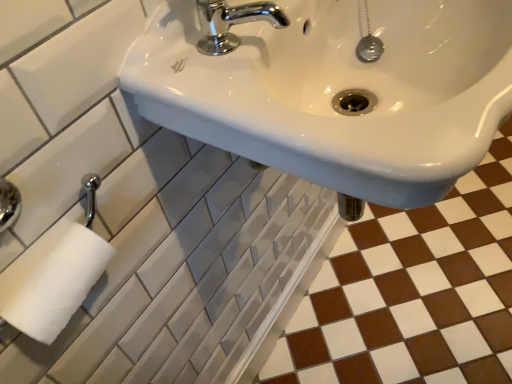
Question: In terms of height, does white glossy sink at upper center look taller or shorter compared to chrome/metallic faucet at upper center?

Choices:
 (A) short
 (B) tall

Answer: (B)

Question: Is white glossy sink at upper center wider or thinner than chrome/metallic faucet at upper center?

Choices:
 (A) wide
 (B) thin

Answer: (A)

Question: Which of these objects is positioned closest to the chrome/metallic faucet at upper center?

Choices:
 (A) brown glossy tile at lower right
 (B) white glossy sink at upper center

Answer: (B)

Question: Estimate the real-world distances between objects in this image. Which object is closer to the brown glossy tile at lower right?

Choices:
 (A) chrome/metallic faucet at upper center
 (B) white glossy sink at upper center

Answer: (B)